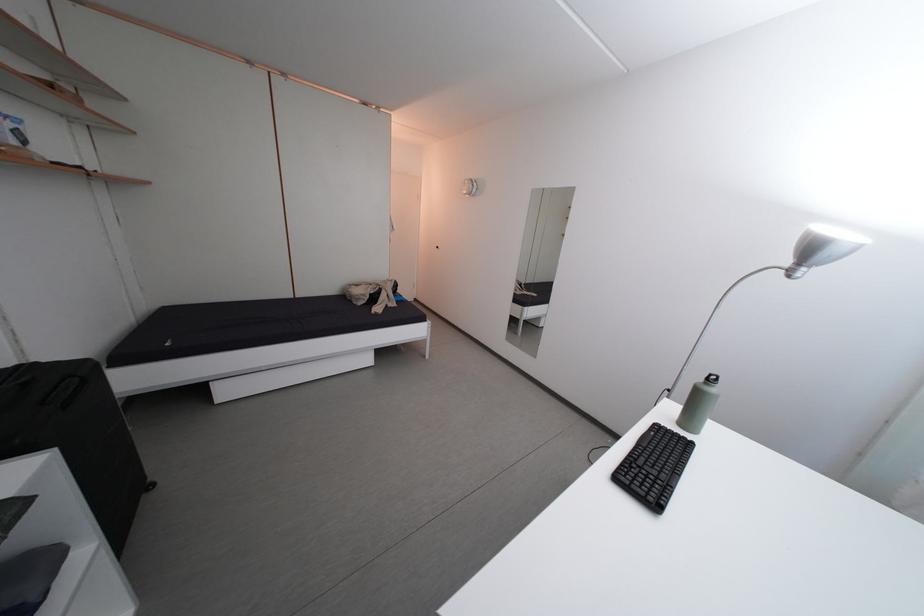
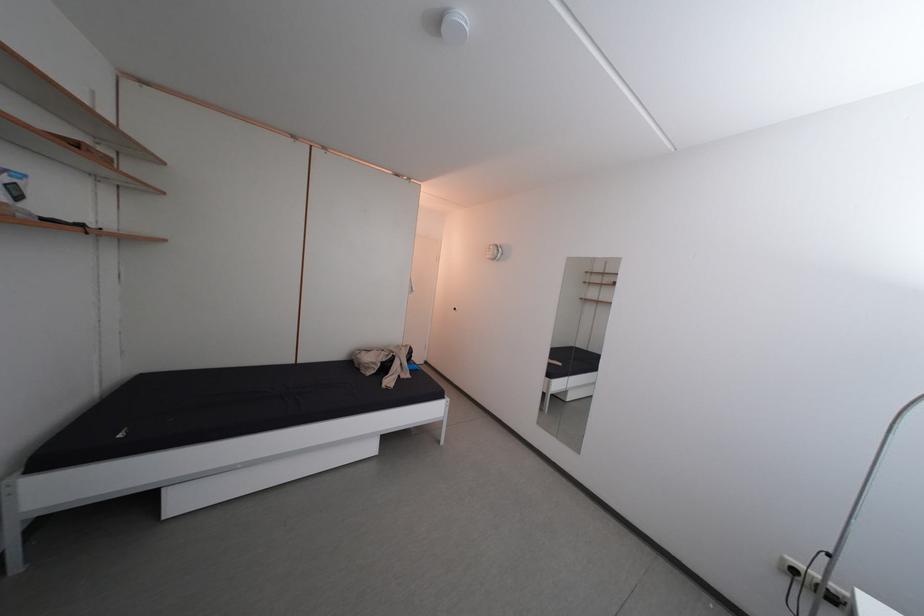
What movement of the cameraman would produce the second image?

The movement direction of the cameraman is left, forward.